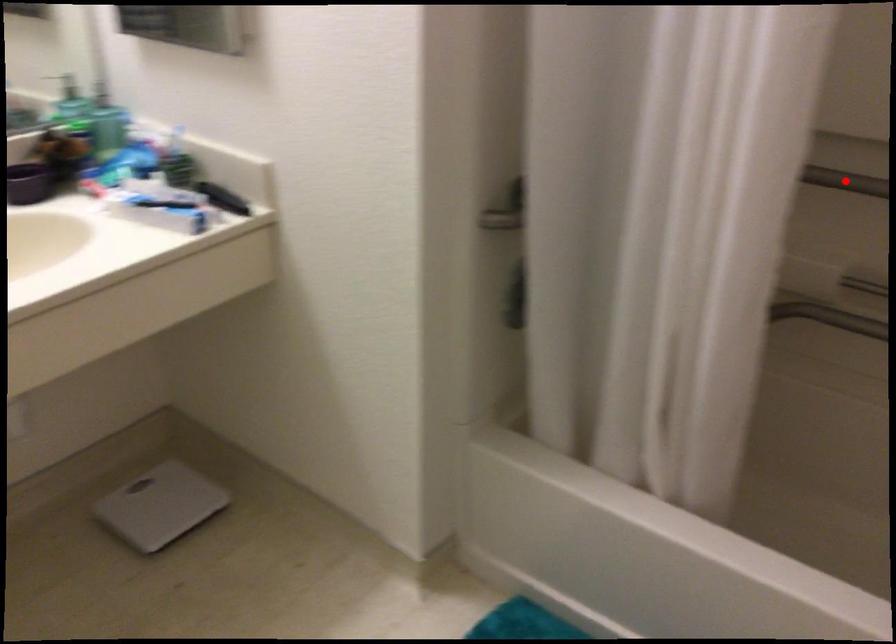
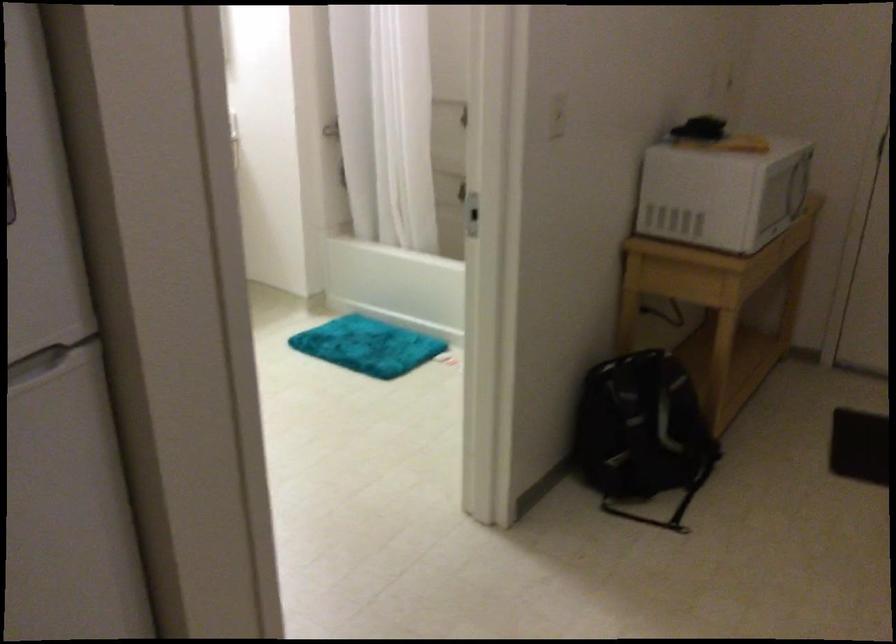
Question: I am providing you with two images of the same scene from different viewpoints. A red point is marked on the first image. Can you still see the location of the red point in image 2?

Choices:
 (A) Yes
 (B) No

Answer: (B)